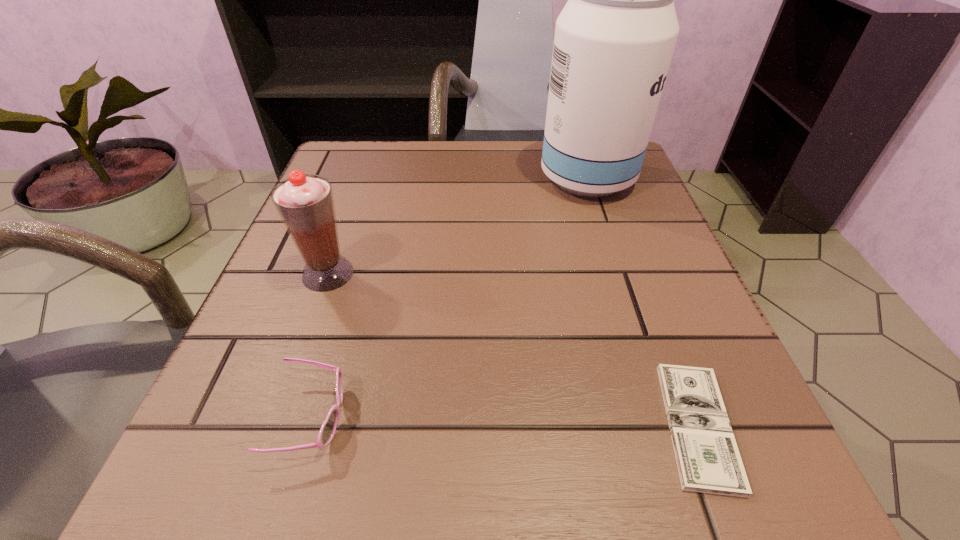
Identify the location of free space between the alcohol and the dollar. The width and height of the screenshot is (960, 540). (642, 302).

Where is `vacant space that is in between the second shortest object and the smoothie`? The image size is (960, 540). vacant space that is in between the second shortest object and the smoothie is located at coordinates (320, 346).

Locate an element on the screen. The image size is (960, 540). free space between the farthest object and the shortest object is located at coordinates (642, 302).

What are the coordinates of `free area in between the second shortest object and the second farthest object` in the screenshot? It's located at (320, 346).

Where is `free spot between the tallest object and the sunglasses`? This screenshot has width=960, height=540. free spot between the tallest object and the sunglasses is located at coordinates (449, 299).

Select which object is the second closest to the dollar. Please provide its 2D coordinates. Your answer should be formatted as a tuple, i.e. [(x, y)], where the tuple contains the x and y coordinates of a point satisfying the conditions above.

[(328, 429)]

Where is `the closest object to the sunglasses`? The width and height of the screenshot is (960, 540). the closest object to the sunglasses is located at coordinates (305, 203).

This screenshot has width=960, height=540. In order to click on free space in the image that satisfies the following two spatial constraints: 1. on the front-facing side of the sunglasses; 2. on the back side of the dollar in this screenshot , I will do `click(309, 426)`.

Where is `free space that satisfies the following two spatial constraints: 1. on the back side of the shortest object; 2. on the front-facing side of the second shortest object`? The image size is (960, 540). free space that satisfies the following two spatial constraints: 1. on the back side of the shortest object; 2. on the front-facing side of the second shortest object is located at coordinates 694,418.

Find the location of a particular element. free space that satisfies the following two spatial constraints: 1. on the front-facing side of the second shortest object; 2. on the back side of the shortest object is located at coordinates (309, 426).